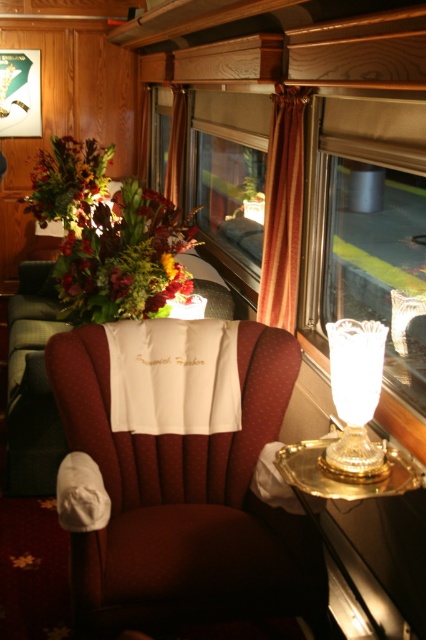
You are a passenger in the train car and want to sit in the satin burgundy armchair at center. Where exactly should you walk to find it?

The satin burgundy armchair at center is located at coordinates point (187,502).

You are a passenger on the train and want to place a book on the nearest available surface. The book is 15 cm wide. The multicolored floral bouquet at center and the orange fabric curtain at upper center are in your view. Which object can you place the book on, and why?

The multicolored floral bouquet at center is positioned on the left side of orange fabric curtain at upper center. Since the orange fabric curtain at upper center is a curtain, it is not a surface. Therefore, the book can be placed on the multicolored floral bouquet at center if there is space, but the description does not provide its size. However, the question mentions the book is 15 cm wide, but the bouquet is an object, so the appropriate surface might be the table mentioned in the scene. However, the 2

You are a passenger on this train and want to sit down. Considering the satin burgundy armchair at center and the orange fabric curtain at center, which one is taller?

The satin burgundy armchair at center is taller than the orange fabric curtain at center.